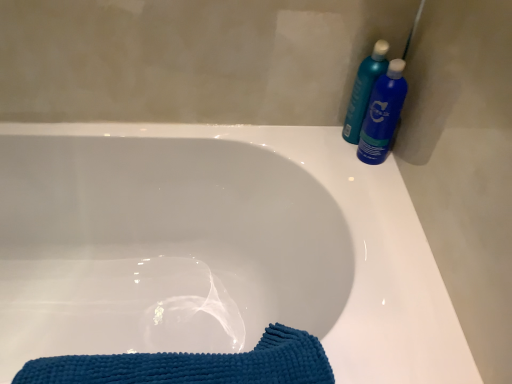
Question: Is white glossy bathtub at center not close to blue glossy bottle at upper right, which ranks as the 1th cleaning product in right-to-left order?

Choices:
 (A) yes
 (B) no

Answer: (B)

Question: Is white glossy bathtub at center at the right side of blue glossy bottle at upper right, arranged as the second cleaning product when viewed from the left?

Choices:
 (A) yes
 (B) no

Answer: (B)

Question: Is white glossy bathtub at center thinner than blue glossy bottle at upper right, which ranks as the 1th cleaning product in right-to-left order?

Choices:
 (A) yes
 (B) no

Answer: (B)

Question: From a real-world perspective, is white glossy bathtub at center on top of blue glossy bottle at upper right, which ranks as the 1th cleaning product in right-to-left order?

Choices:
 (A) no
 (B) yes

Answer: (A)

Question: Is white glossy bathtub at center looking in the opposite direction of blue glossy bottle at upper right, arranged as the second cleaning product when viewed from the left?

Choices:
 (A) no
 (B) yes

Answer: (A)

Question: From their relative heights in the image, would you say white glossy bathtub at center is taller or shorter than blue textured towel at lower left?

Choices:
 (A) tall
 (B) short

Answer: (A)

Question: Looking at the image, does white glossy bathtub at center seem bigger or smaller compared to blue textured towel at lower left?

Choices:
 (A) big
 (B) small

Answer: (A)

Question: Considering the positions of white glossy bathtub at center and blue textured towel at lower left in the image, is white glossy bathtub at center wider or thinner than blue textured towel at lower left?

Choices:
 (A) wide
 (B) thin

Answer: (A)

Question: Relative to blue textured towel at lower left, is white glossy bathtub at center in front or behind?

Choices:
 (A) behind
 (B) front

Answer: (B)

Question: Considering the positions of point (462, 339) and point (347, 134), is point (462, 339) closer or farther from the camera than point (347, 134)?

Choices:
 (A) farther
 (B) closer

Answer: (B)

Question: Considering the positions of white glossy bathtub at center and teal plastic bottles at upper right, which appears as the 2th cleaning product when viewed from the right, in the image, is white glossy bathtub at center taller or shorter than teal plastic bottles at upper right, which appears as the 2th cleaning product when viewed from the right,?

Choices:
 (A) tall
 (B) short

Answer: (A)

Question: From the image's perspective, relative to teal plastic bottles at upper right, which is the first cleaning product in left-to-right order, is white glossy bathtub at center above or below?

Choices:
 (A) below
 (B) above

Answer: (A)

Question: Is white glossy bathtub at center wider or thinner than teal plastic bottles at upper right, which is the first cleaning product in left-to-right order?

Choices:
 (A) thin
 (B) wide

Answer: (B)

Question: Is white glossy bathtub at center taller or shorter than blue glossy bottle at upper right, which ranks as the 1th cleaning product in right-to-left order?

Choices:
 (A) short
 (B) tall

Answer: (B)

Question: Is white glossy bathtub at center bigger or smaller than blue glossy bottle at upper right, which ranks as the 1th cleaning product in right-to-left order?

Choices:
 (A) big
 (B) small

Answer: (A)